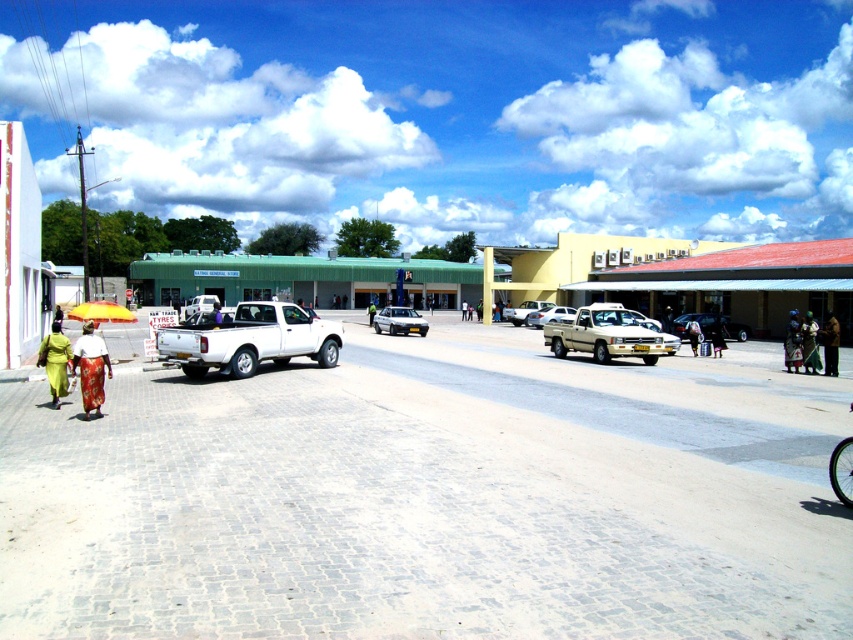
Describe the element at coordinates (399, 321) in the screenshot. This screenshot has width=853, height=640. I see `silver metallic sedan at center` at that location.

The width and height of the screenshot is (853, 640). Describe the element at coordinates (399, 321) in the screenshot. I see `silver metallic sedan at center` at that location.

Where is `silver metallic sedan at center`? This screenshot has width=853, height=640. silver metallic sedan at center is located at coordinates (399, 321).

Is metallic silver car at center smaller than dark brown leather jacket at center?

No, metallic silver car at center is not smaller than dark brown leather jacket at center.

Is point (532, 320) farther from camera compared to point (688, 330)?

Yes, it is behind point (688, 330).

Find the location of a particular element. The height and width of the screenshot is (640, 853). metallic silver car at center is located at coordinates (548, 316).

Who is shorter, matte yellow umbrella at lower left or dark blue fabric bag at right?

matte yellow umbrella at lower left is shorter.

Is matte yellow umbrella at lower left bigger than dark blue fabric bag at right?

No.

Which is behind, point (74, 348) or point (796, 339)?

The point (796, 339) is behind.

Locate an element on the screen. The width and height of the screenshot is (853, 640). matte yellow umbrella at lower left is located at coordinates (90, 369).